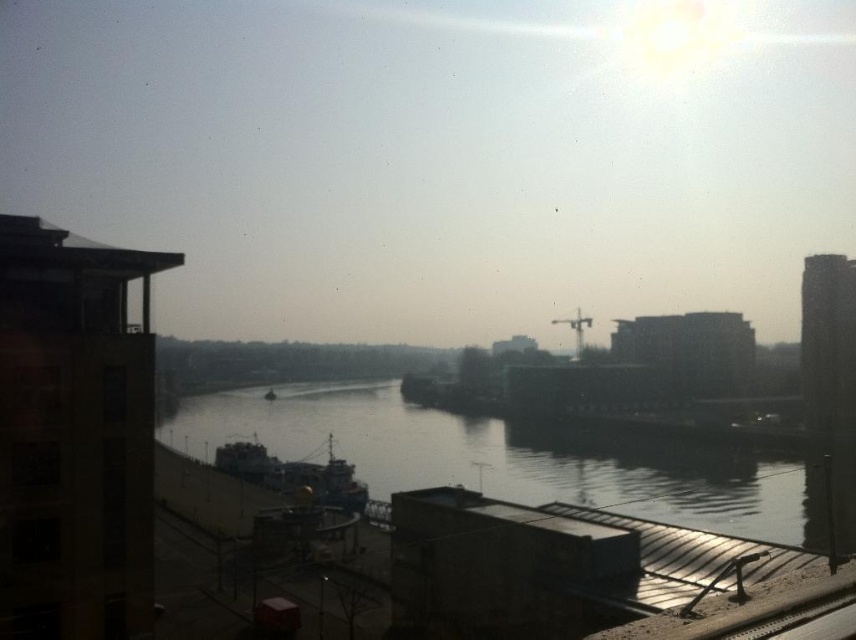
You are a photographer planning to take a photo of the smooth concrete river at center and the dark blue metallic ship at center. Since the sun is causing glare, where should you position yourself to avoid the glare while capturing both objects in the frame?

You should position yourself to the left of the smooth concrete river at center and dark blue metallic ship at center to avoid the glare from the sun in the upper right corner, as the river is to the right of the ship.

You are a photographer standing on the riverbank and want to take a photo of both the smooth concrete river at center and the dark blue metallic ship at center. Which object should you focus on first to ensure both are in sharp focus?

You should focus on the dark blue metallic ship at center first because the smooth concrete river at center is in front of it, so focusing on the ship will help ensure both are in focus.